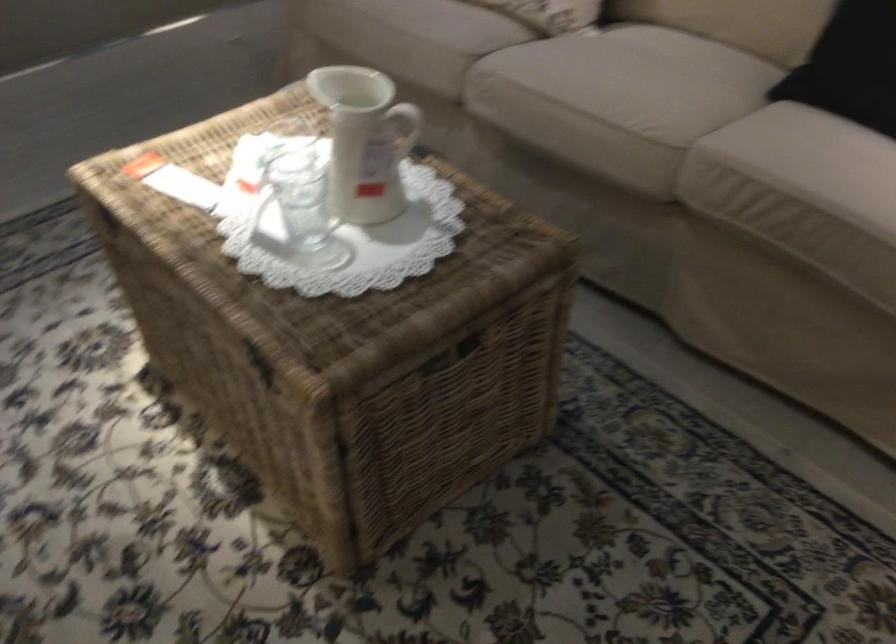
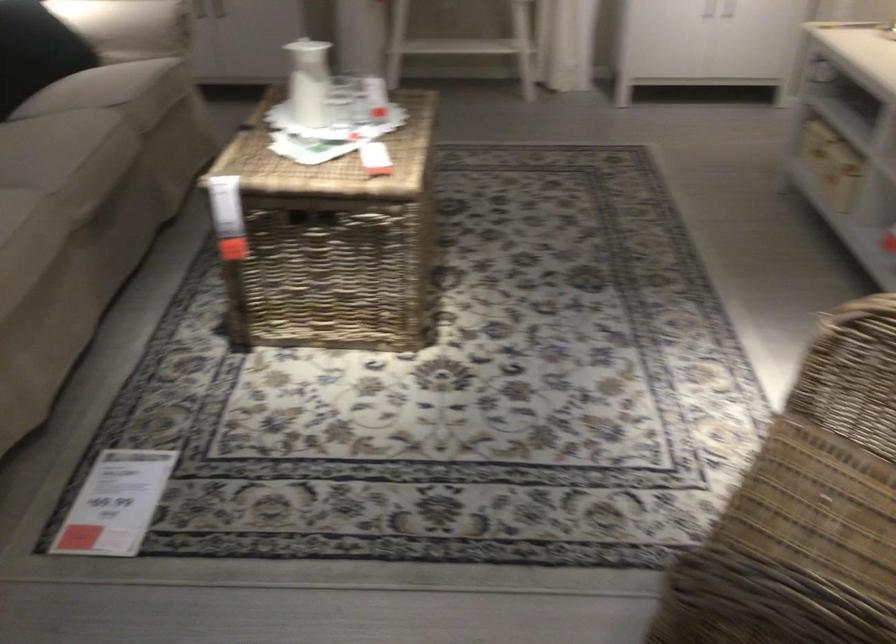
The point at (605,120) is marked in the first image. Where is the corresponding point in the second image?

(109, 140)